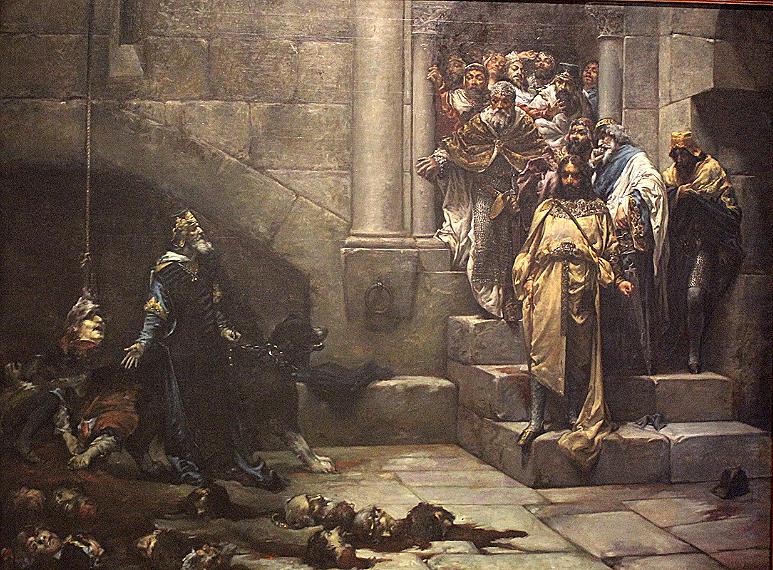
Where is `painting`? painting is located at coordinates (392, 237).